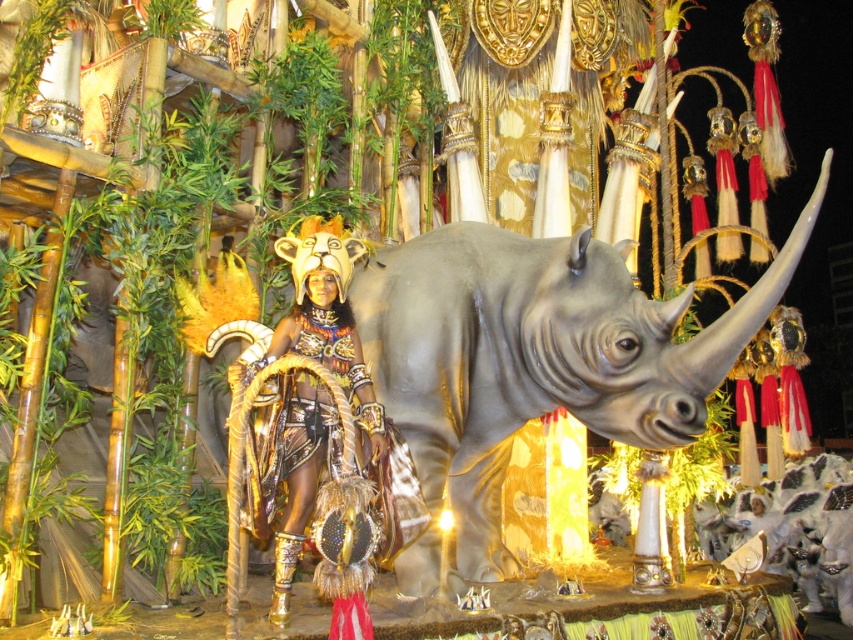
Can you confirm if gray matte rhinoceros at center is wider than metallic gold headdress at center?

Yes.

I want to click on gray matte rhinoceros at center, so click(x=531, y=362).

Find the location of `gray matte rhinoceros at center`. gray matte rhinoceros at center is located at coordinates (531, 362).